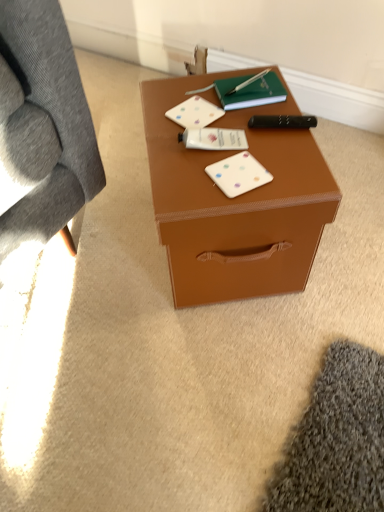
This screenshot has width=384, height=512. What are the coordinates of `spots to the right of white matte card game at center, positioned as the first card game in front-to-back order` in the screenshot? It's located at 291,170.